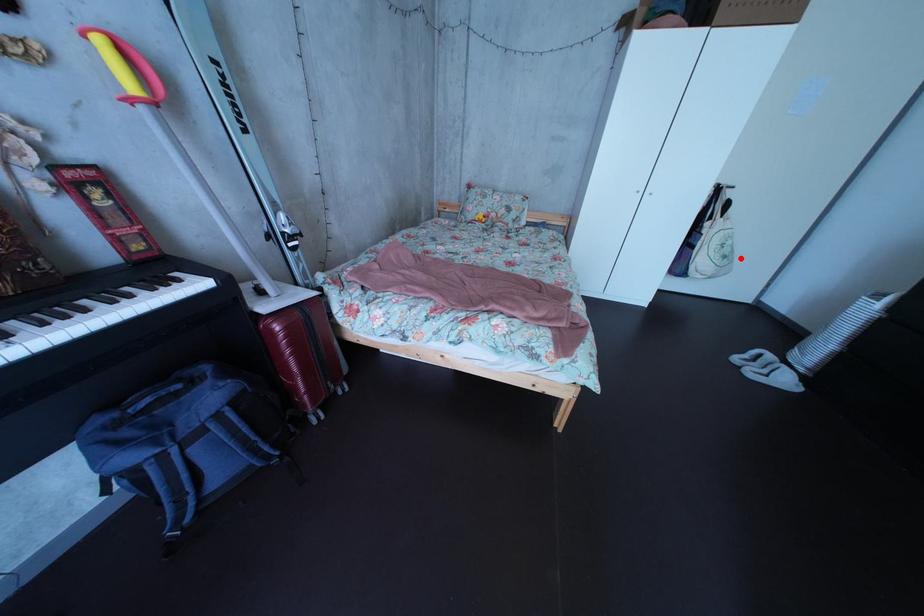
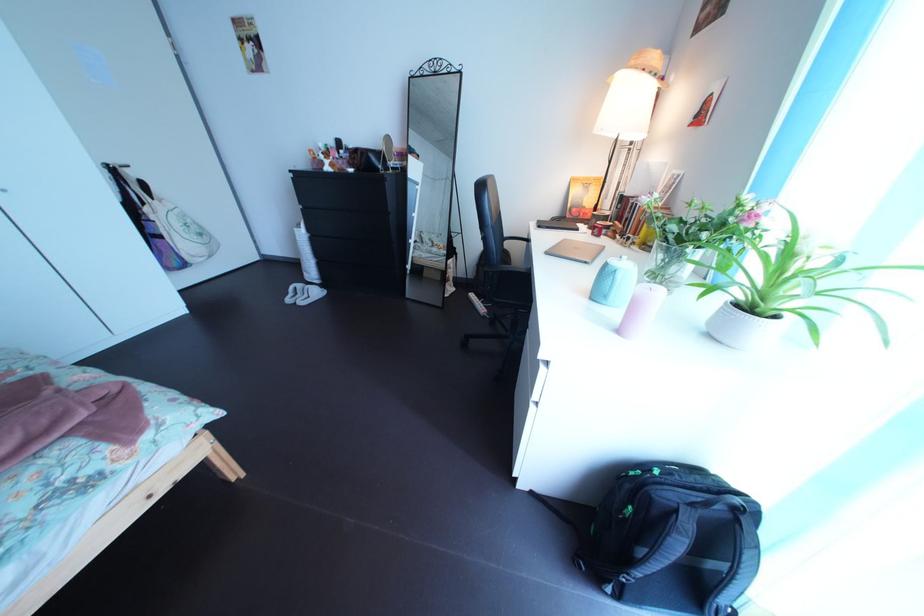
Find the pixel in the second image that matches the highlighted location in the first image.

(209, 237)